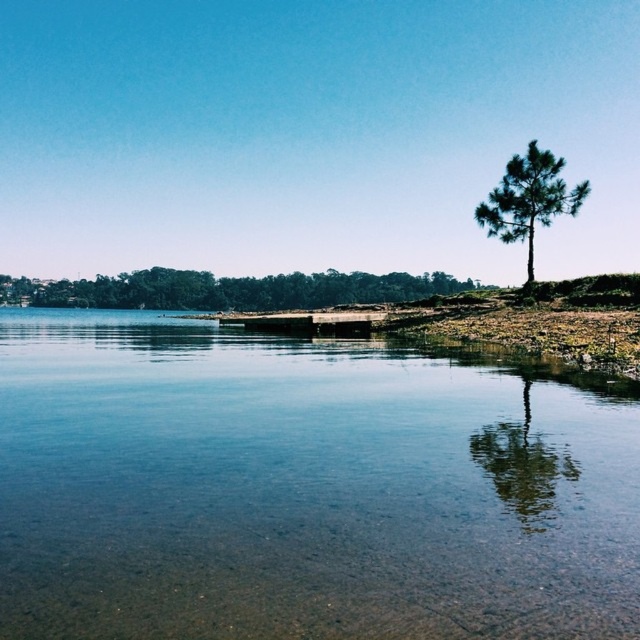
Question: Does green matte tree at center have a greater width compared to wooden dock at center?

Choices:
 (A) yes
 (B) no

Answer: (A)

Question: Is green matte tree at center positioned before green matte tree at upper right?

Choices:
 (A) no
 (B) yes

Answer: (A)

Question: Estimate the real-world distances between objects in this image. Which object is farther from the green matte tree at upper right?

Choices:
 (A) clear water at center
 (B) green matte tree at center

Answer: (B)

Question: Is the position of clear water at center less distant than that of wooden dock at center?

Choices:
 (A) no
 (B) yes

Answer: (B)

Question: Considering the real-world distances, which object is closest to the green matte tree at upper right?

Choices:
 (A) wooden dock at center
 (B) green matte tree at center

Answer: (A)

Question: Which point is closer to the camera?

Choices:
 (A) (387, 282)
 (B) (520, 195)

Answer: (B)